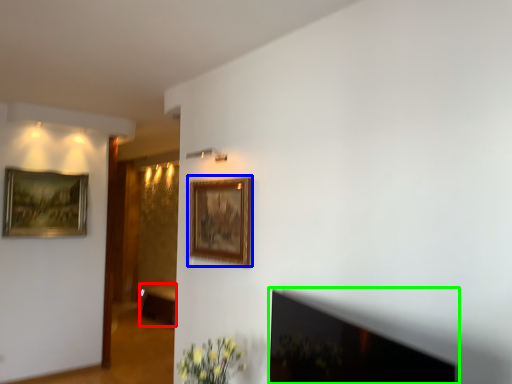
Question: Which object is the farthest from furniture (highlighted by a red box)? Choose among these: picture frame (highlighted by a blue box) or fireplace (highlighted by a green box).

Choices:
 (A) picture frame
 (B) fireplace

Answer: (B)